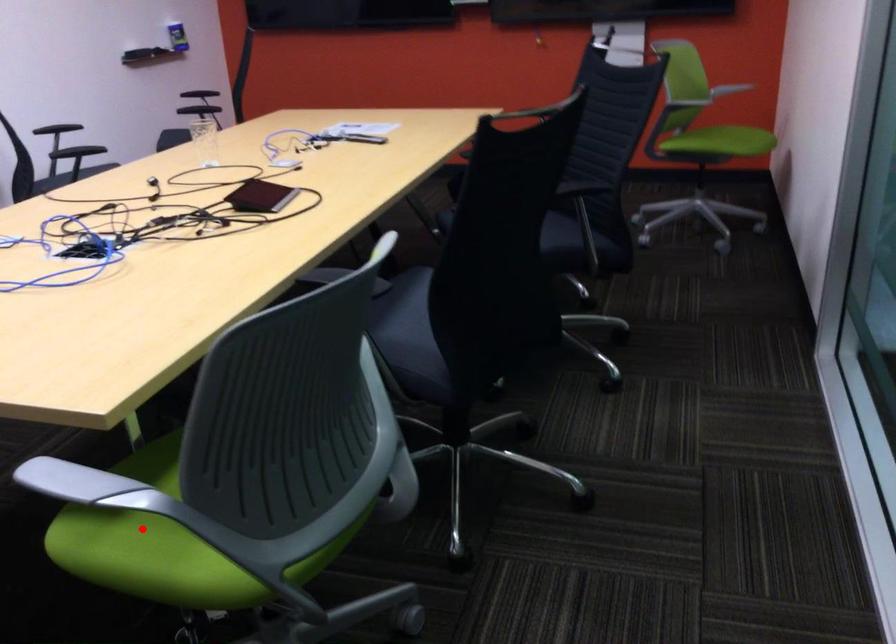
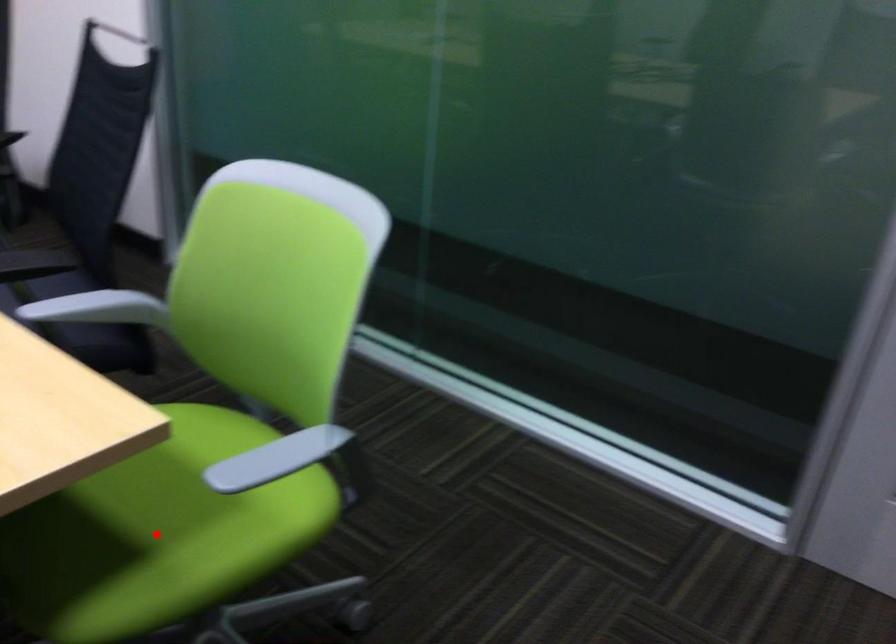
I am providing you with two images of the same scene from different viewpoints. A red point is marked on the first image and another point is marked on the second image. Is the red point in image1 aligned with the point shown in image2?

Yes